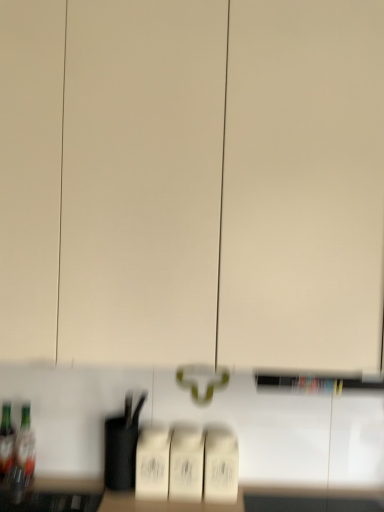
Question: From their relative heights in the image, would you say translucent glass bottle at lower left, which ranks as the 1th bottle in right-to-left order, is taller or shorter than translucent glass bottle at lower left, the 2th bottle when ordered from right to left?

Choices:
 (A) tall
 (B) short

Answer: (A)

Question: In terms of width, does translucent glass bottle at lower left, which ranks as the 1th bottle in right-to-left order, look wider or thinner when compared to translucent glass bottle at lower left, the 2th bottle when ordered from right to left?

Choices:
 (A) wide
 (B) thin

Answer: (B)

Question: From the image's perspective, is translucent glass bottle at lower left, which ranks as the 1th bottle in right-to-left order, located above or below translucent glass bottle at lower left, acting as the 1th bottle starting from the left?

Choices:
 (A) below
 (B) above

Answer: (A)

Question: Is point (1, 411) closer or farther from the camera than point (33, 468)?

Choices:
 (A) farther
 (B) closer

Answer: (A)

Question: Considering the positions of translucent glass bottle at lower left, the 2th bottle when ordered from right to left, and translucent glass bottle at lower left, which ranks as the 1th bottle in right-to-left order, in the image, is translucent glass bottle at lower left, the 2th bottle when ordered from right to left, bigger or smaller than translucent glass bottle at lower left, which ranks as the 1th bottle in right-to-left order,?

Choices:
 (A) big
 (B) small

Answer: (B)

Question: From the image's perspective, is translucent glass bottle at lower left, acting as the 1th bottle starting from the left, positioned above or below translucent glass bottle at lower left, which ranks as the 1th bottle in right-to-left order?

Choices:
 (A) above
 (B) below

Answer: (A)

Question: From a real-world perspective, is translucent glass bottle at lower left, acting as the 1th bottle starting from the left, above or below translucent glass bottle at lower left, which ranks as the 1th bottle in right-to-left order?

Choices:
 (A) above
 (B) below

Answer: (B)